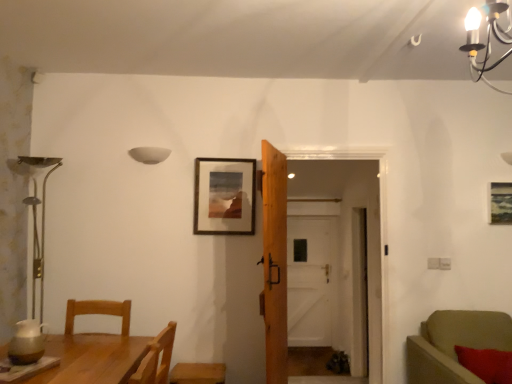
Question: Does wooden picture frame at center, arranged as the 1th picture frame when viewed from the left, contain white wooden door at center, acting as the 2th door starting from the left?

Choices:
 (A) no
 (B) yes

Answer: (A)

Question: Is wooden picture frame at center, arranged as the 1th picture frame when viewed from the left, positioned in front of white wooden door at center, the 1th door positioned from the right?

Choices:
 (A) yes
 (B) no

Answer: (A)

Question: Is wooden picture frame at center, the second picture frame when ordered from right to left, thinner than white wooden door at center, the 1th door in the back-to-front sequence?

Choices:
 (A) no
 (B) yes

Answer: (B)

Question: Is wooden picture frame at center, the second picture frame when ordered from right to left, next to white wooden door at center, the second door from the front?

Choices:
 (A) yes
 (B) no

Answer: (B)

Question: Is wooden picture frame at center, the second picture frame when ordered from right to left, not close to white wooden door at center, the 1th door in the back-to-front sequence?

Choices:
 (A) yes
 (B) no

Answer: (A)

Question: From the image's perspective, is white matte bowl at upper center positioned above or below wooden table at lower left?

Choices:
 (A) below
 (B) above

Answer: (B)

Question: Is white matte bowl at upper center in front of or behind wooden table at lower left in the image?

Choices:
 (A) front
 (B) behind

Answer: (B)

Question: In terms of width, does white matte bowl at upper center look wider or thinner when compared to wooden table at lower left?

Choices:
 (A) wide
 (B) thin

Answer: (B)

Question: Is white matte bowl at upper center to the left or to the right of wooden table at lower left in the image?

Choices:
 (A) right
 (B) left

Answer: (B)

Question: Relative to red fuzzy pillow at lower right, is wooden picture frame at upper right, the second picture frame when ordered from left to right, in front or behind?

Choices:
 (A) behind
 (B) front

Answer: (A)

Question: Is wooden picture frame at upper right, the second picture frame when ordered from left to right, to the left or to the right of red fuzzy pillow at lower right in the image?

Choices:
 (A) right
 (B) left

Answer: (A)

Question: Looking at the image, does wooden picture frame at upper right, positioned as the 1th picture frame in right-to-left order, seem bigger or smaller compared to red fuzzy pillow at lower right?

Choices:
 (A) big
 (B) small

Answer: (B)

Question: Considering the positions of wooden picture frame at upper right, positioned as the 1th picture frame in right-to-left order, and red fuzzy pillow at lower right in the image, is wooden picture frame at upper right, positioned as the 1th picture frame in right-to-left order, wider or thinner than red fuzzy pillow at lower right?

Choices:
 (A) thin
 (B) wide

Answer: (A)

Question: Considering the positions of wooden picture frame at center, the second picture frame when ordered from right to left, and velvet green sofa at right in the image, is wooden picture frame at center, the second picture frame when ordered from right to left, bigger or smaller than velvet green sofa at right?

Choices:
 (A) small
 (B) big

Answer: (A)

Question: From the image's perspective, is wooden picture frame at center, arranged as the 1th picture frame when viewed from the left, above or below velvet green sofa at right?

Choices:
 (A) above
 (B) below

Answer: (A)